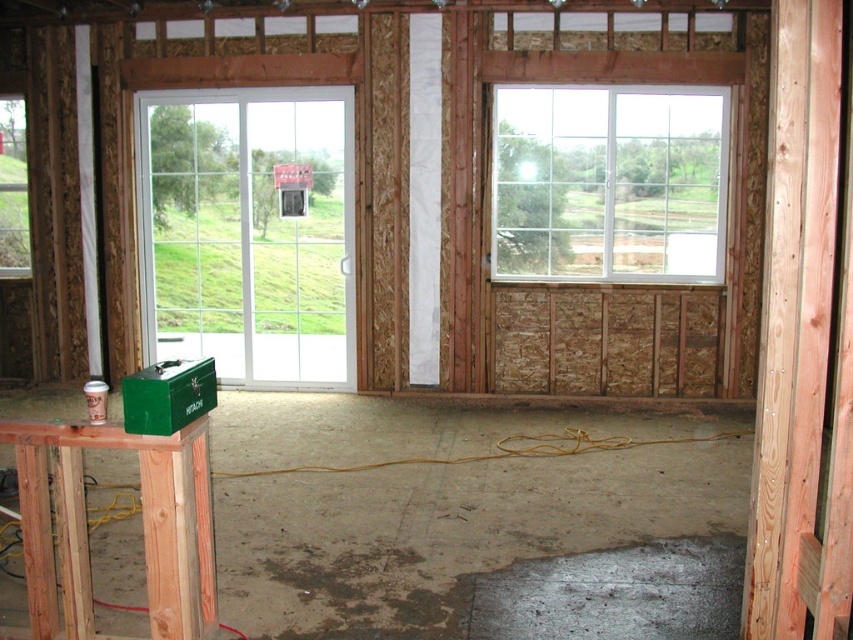
Question: Which point is farther to the camera?

Choices:
 (A) (569, 272)
 (B) (273, 150)

Answer: (B)

Question: Is white glass door at left smaller than white plastic window at upper right?

Choices:
 (A) no
 (B) yes

Answer: (A)

Question: Can you confirm if white glass door at left is wider than white plastic window at upper right?

Choices:
 (A) no
 (B) yes

Answer: (B)

Question: Can you confirm if white glass door at left is positioned to the right of white plastic window at upper right?

Choices:
 (A) no
 (B) yes

Answer: (A)

Question: Which of the following is the closest to the observer?

Choices:
 (A) white plastic window at upper right
 (B) white glass door at left

Answer: (A)

Question: Which point is farther from the camera taking this photo?

Choices:
 (A) (164, 138)
 (B) (527, 140)

Answer: (A)